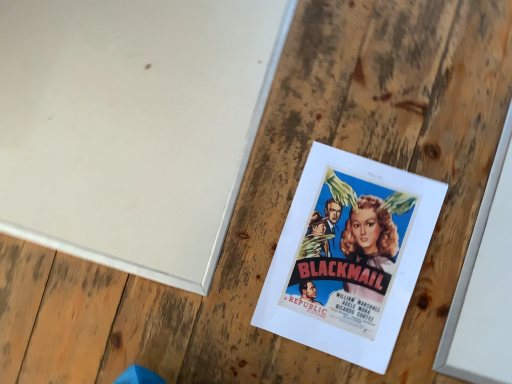
Locate an element on the screen. empty space that is ontop of white matte bulletin board at upper left (from a real-world perspective) is located at coordinates (114, 132).